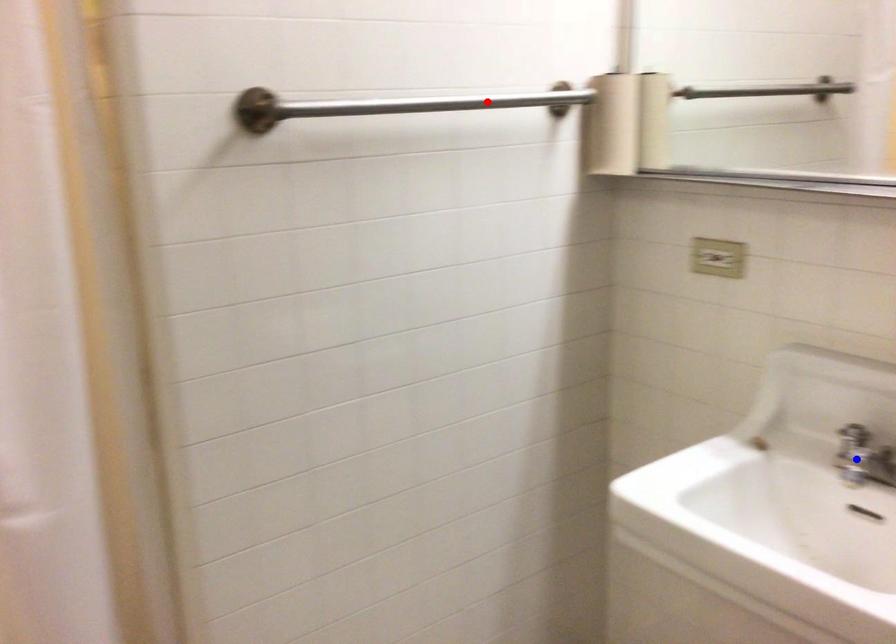
Question: Which of the two points in the image is closer to the camera?

Choices:
 (A) Blue point is closer.
 (B) Red point is closer.

Answer: (A)